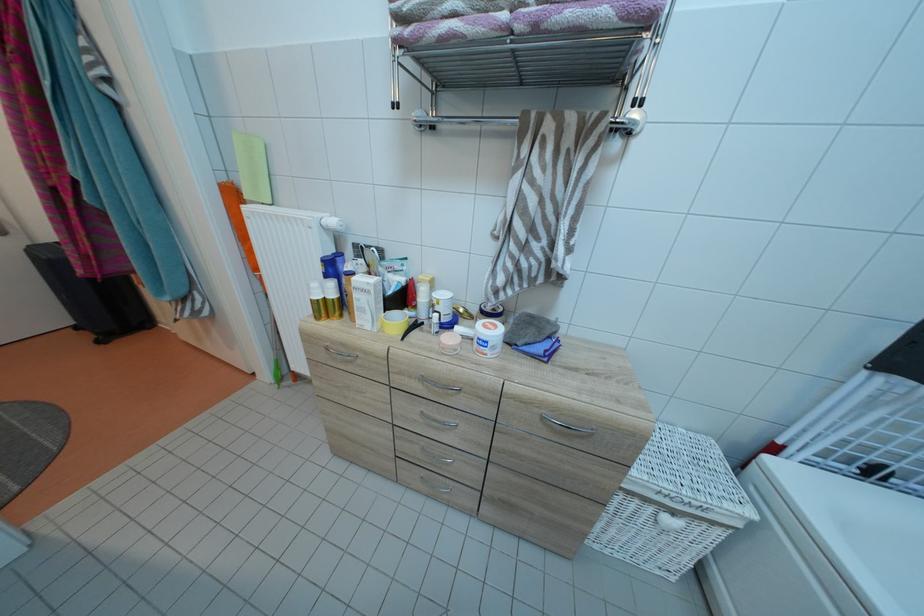
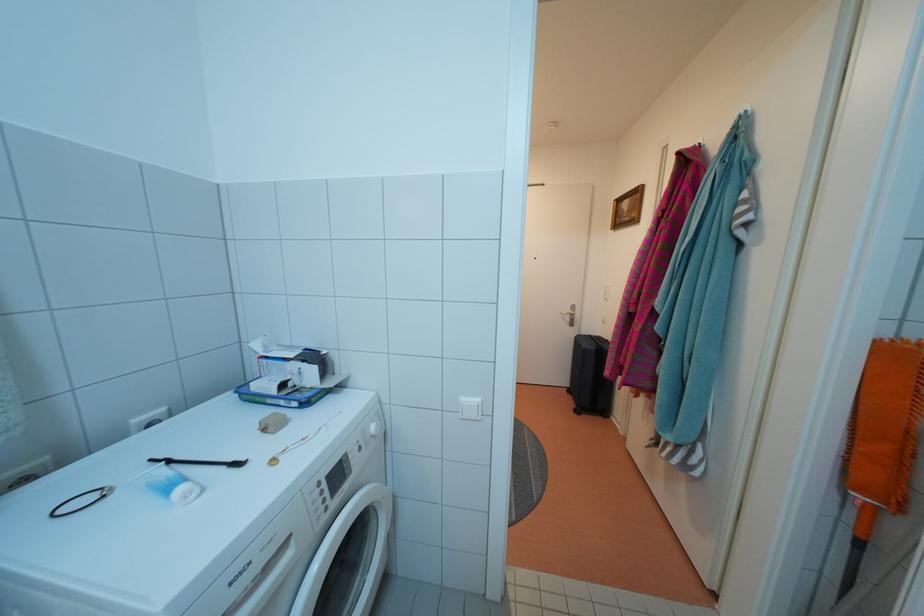
Question: The camera is either moving clockwise (left) or counter-clockwise (right) around the object. The first image is from the beginning of the video and the second image is from the end. Is the camera moving left or right when shooting the video?

Choices:
 (A) Left
 (B) Right

Answer: (B)